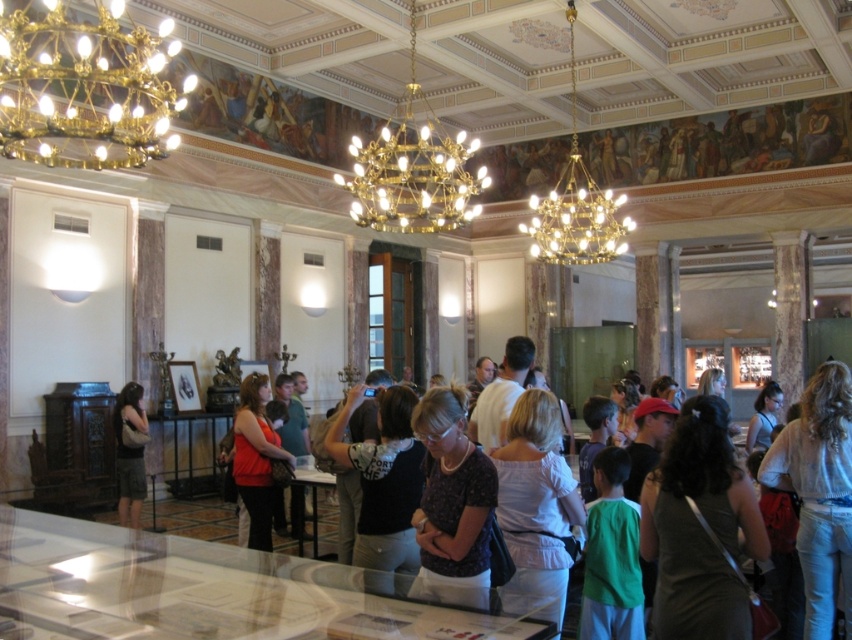
You are a visitor in this ornate museum room and notice both the gold metallic chandelier at center and the dark gray shirt at center. Which object is taller?

The dark gray shirt at center is taller than the gold metallic chandelier at center.

You are an interior designer planning to place a new sculpture in the center of the room. The sculpture will be the same size as the gold metallic chandelier at center. Will the sculpture fit without overlapping the dark gray fabric dress at center?

The dark gray fabric dress at center is bigger than the gold metallic chandelier at center. Since the sculpture will be the same size as the chandelier, it will be smaller than the dress. Therefore, the sculpture should fit without overlapping the dress as long as it is placed in the available space around the dress.

You are standing in the room and want to take a photo of both the gold metallic chandelier at center and the dark gray shirt at center. Given that your camera has a maximum focus range of 10 meters, will you be able to capture both objects clearly in the same photo?

The gold metallic chandelier at center is 10.89 meters away from the dark gray shirt at center. Since the camera can only focus up to 10 meters, the distance between them exceeds the maximum focus range. Therefore, you won generated by the system.